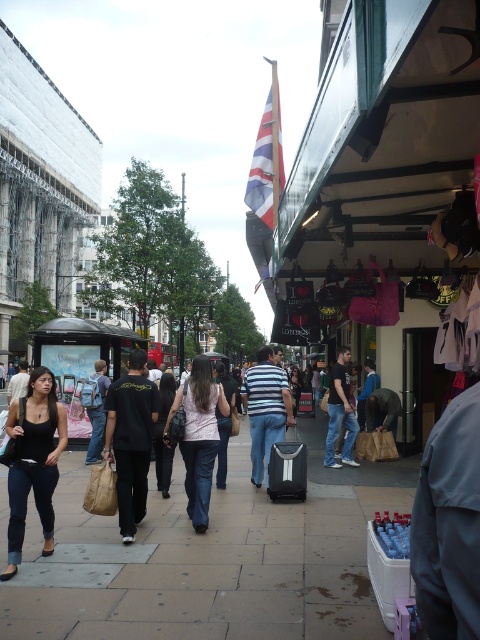
Which is in front, point (332, 372) or point (267, 486)?

Point (267, 486) is more forward.

Is point (347, 372) farther from camera compared to point (276, 467)?

Yes, it is.

Find the location of a particular element. black cotton t-shirt at center is located at coordinates (339, 412).

Locate an element on the screen. Image resolution: width=480 pixels, height=640 pixels. black cotton t-shirt at center is located at coordinates (339, 412).

Which is more to the left, smooth concrete sidewalk at center or black cotton t-shirt at center?

smooth concrete sidewalk at center

Can you confirm if smooth concrete sidewalk at center is positioned to the right of black cotton t-shirt at center?

No, smooth concrete sidewalk at center is not to the right of black cotton t-shirt at center.

Is point (154, 579) positioned before point (356, 420)?

Yes.

Locate an element on the screen. The width and height of the screenshot is (480, 640). smooth concrete sidewalk at center is located at coordinates (212, 557).

Based on the photo, between striped cotton shirt at center and black backpack at center, which one is positioned higher?

black backpack at center is above.

Is striped cotton shirt at center closer to the viewer compared to black backpack at center?

Yes, striped cotton shirt at center is in front of black backpack at center.

Is point (274, 422) positioned before point (101, 390)?

Yes, it is in front of point (101, 390).

Image resolution: width=480 pixels, height=640 pixels. Identify the location of striped cotton shirt at center. (265, 410).